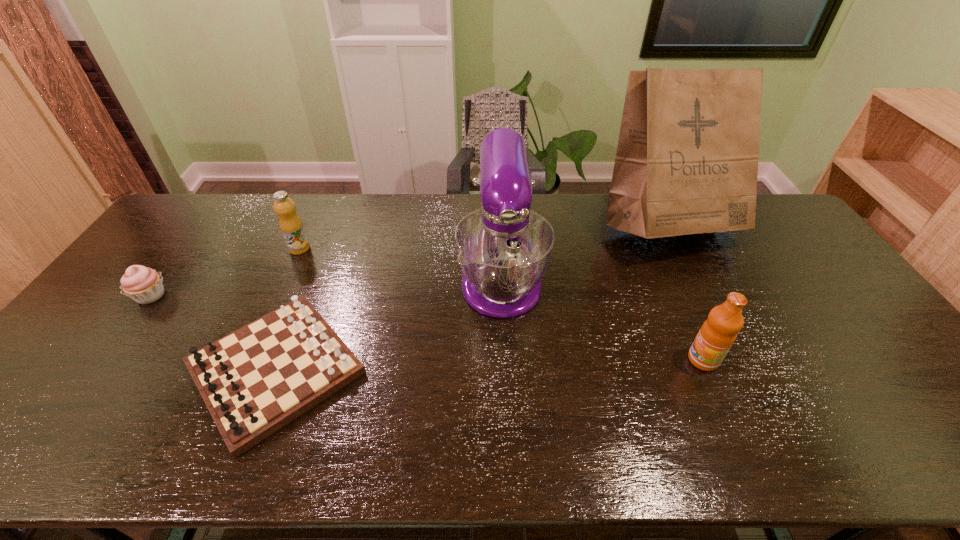
Locate an element on the screen. This screenshot has height=540, width=960. vacant space located 0.380m on the label side of the right fruit juice is located at coordinates (540, 360).

The width and height of the screenshot is (960, 540). Find the location of `vacant space located on the label side of the right fruit juice`. vacant space located on the label side of the right fruit juice is located at coordinates (649, 360).

You are a GUI agent. You are given a task and a screenshot of the screen. Output one action in this format:
    pyautogui.click(x=<x>, y=<y>)
    Task: Click on the vacant space located on the label side of the right fruit juice
    
    Given the screenshot: What is the action you would take?
    pyautogui.click(x=570, y=360)

The image size is (960, 540). Find the location of `vacant space situated on the front label of the farther fruit juice`. vacant space situated on the front label of the farther fruit juice is located at coordinates (380, 248).

I want to click on vacant region located 0.350m on the back of the cupcake, so click(x=212, y=214).

This screenshot has height=540, width=960. In order to click on vacant space located 0.220m on the left of the shortest object in this screenshot , I will do `click(97, 368)`.

This screenshot has height=540, width=960. Find the location of `grocery bag positioned at the far edge`. grocery bag positioned at the far edge is located at coordinates (687, 156).

The height and width of the screenshot is (540, 960). Find the location of `mixer situated at the far edge`. mixer situated at the far edge is located at coordinates tap(504, 248).

In order to click on object present at the near edge in this screenshot , I will do `click(254, 381)`.

What are the coordinates of `object present at the left edge` in the screenshot? It's located at (144, 285).